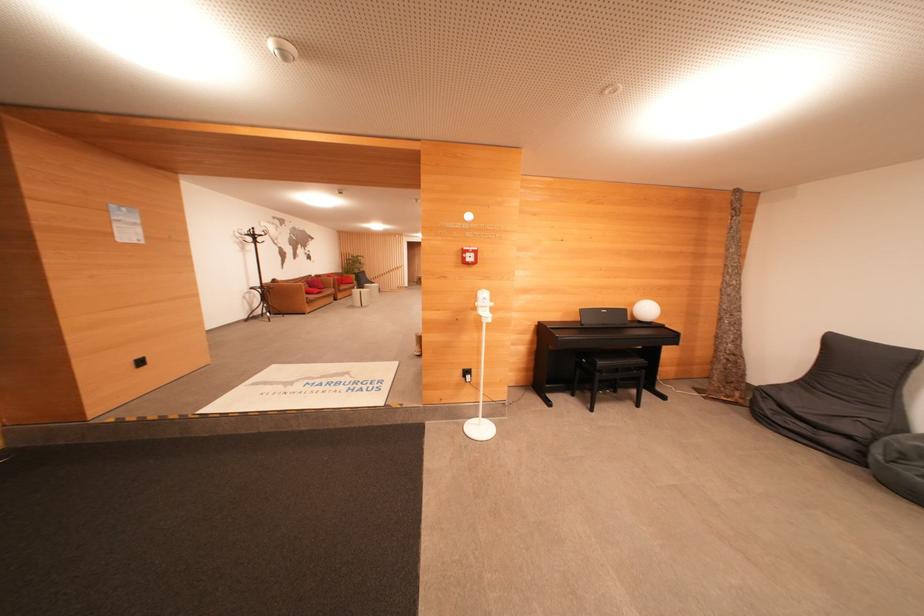
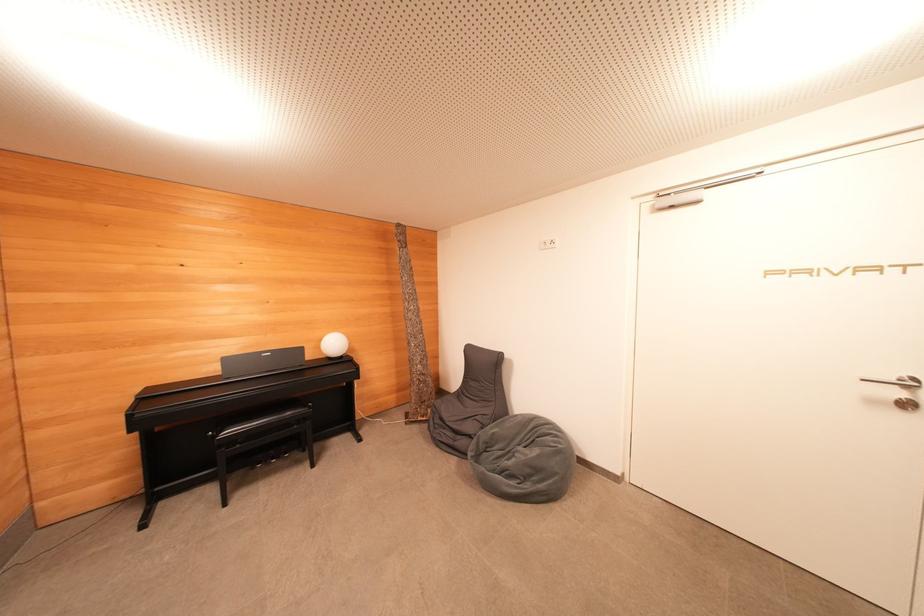
Locate, in the second image, the point that corresponds to the point at 586,315 in the first image.

(229, 363)